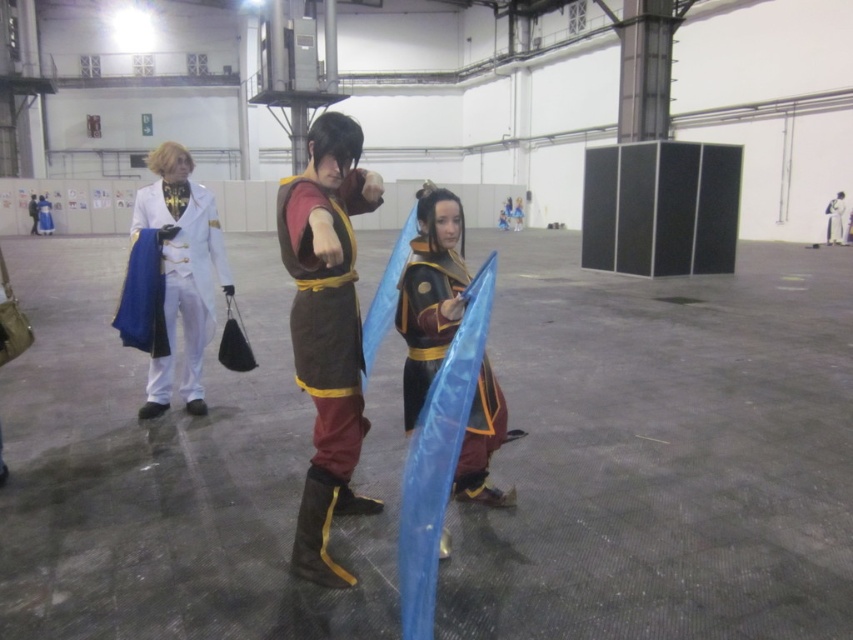
Who is higher up, white glossy coat at left or white glossy coat at center?

white glossy coat at center is above.

Can you confirm if white glossy coat at left is smaller than white glossy coat at center?

Indeed, white glossy coat at left has a smaller size compared to white glossy coat at center.

Who is more distant from viewer, (x=213, y=244) or (x=828, y=237)?

Positioned behind is point (x=828, y=237).

This screenshot has width=853, height=640. Find the location of `white glossy coat at left`. white glossy coat at left is located at coordinates (183, 269).

Between brown leather tunic at center and white glossy coat at left, which one has more height?

With more height is brown leather tunic at center.

Can you confirm if brown leather tunic at center is smaller than white glossy coat at left?

Incorrect, brown leather tunic at center is not smaller in size than white glossy coat at left.

Locate an element on the screen. The width and height of the screenshot is (853, 640). brown leather tunic at center is located at coordinates (328, 330).

Can you confirm if brown leather tunic at center is positioned to the right of shiny gold armor at center?

No, brown leather tunic at center is not to the right of shiny gold armor at center.

Is point (343, 381) closer to camera compared to point (430, 236)?

Yes, it is in front of point (430, 236).

This screenshot has height=640, width=853. What are the coordinates of `brown leather tunic at center` in the screenshot? It's located at click(x=328, y=330).